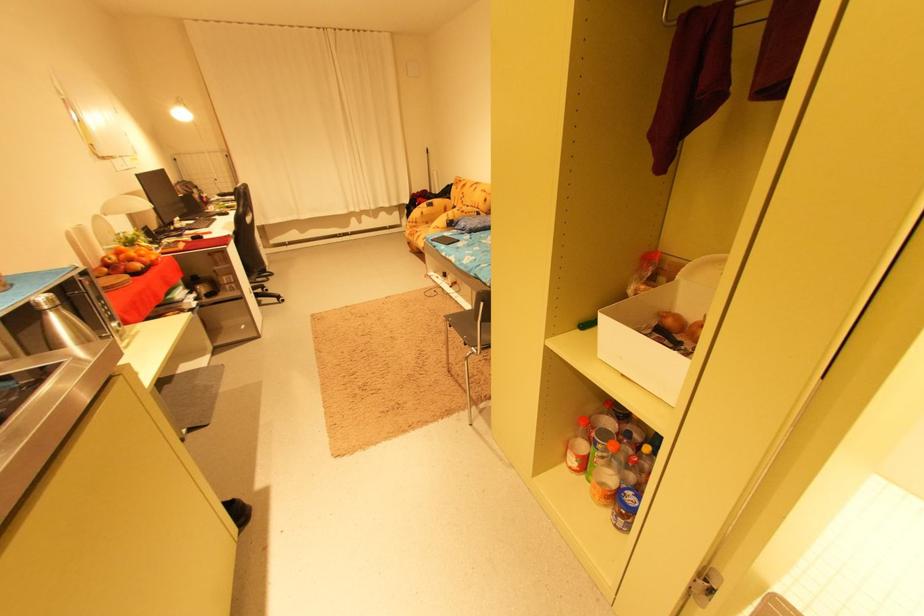
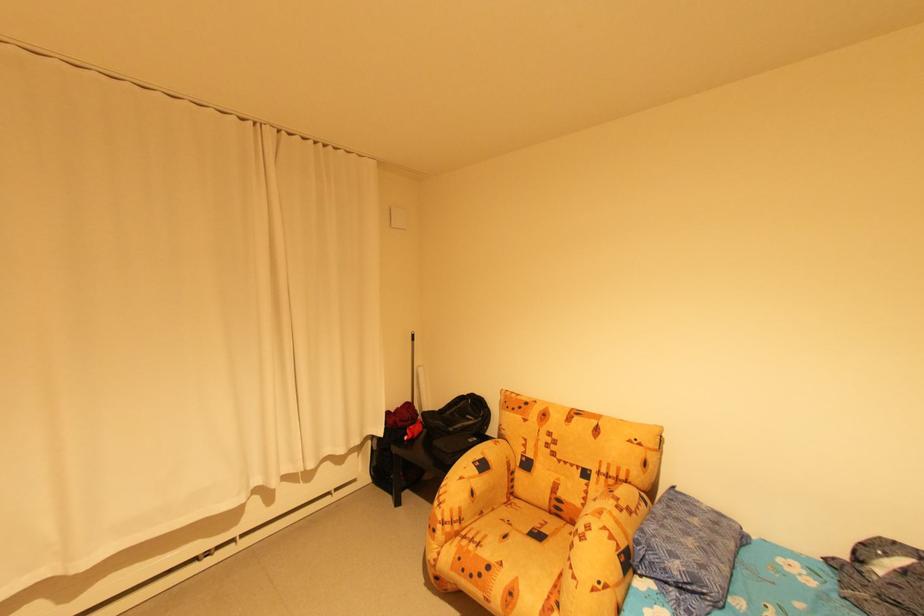
Find the pixel in the second image that matches [459,221] in the first image.

(636, 548)